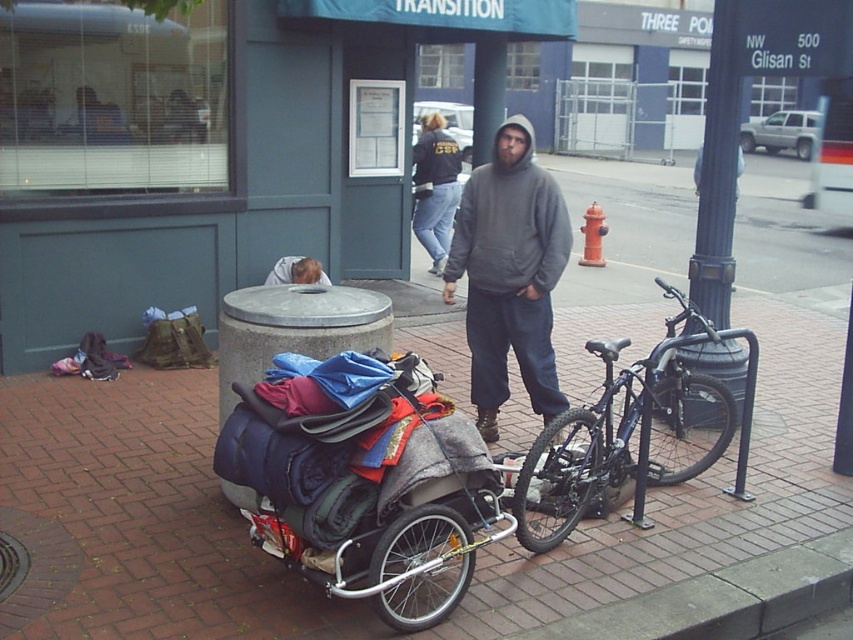
Consider the image. You are a delivery person who needs to reach a package on the sidewalk. You see the shiny blue bike at center and the dark blue jeans at center. Which object is closer to your current position?

The dark blue jeans at center are closer to your current position because the shiny blue bike at center is positioned to the right of them, meaning the jeans are between you and the bike.

Looking at this image, you are a delivery person who needs to transport a package from the shiny blue bike at center to the blue fabric sleeping bag at lower left. Which object should you move the package to, and why?

You should move the package to the blue fabric sleeping bag at lower left because the shiny blue bike at center is larger in size and may not be the destination for the package.

You are a delivery person who needs to pick up a package from the blue fabric sleeping bag at lower left. You are currently standing next to the shiny blue bike at center. Can you reach the sleeping bag without moving the bike?

The shiny blue bike at center is closer to the viewer than the blue fabric sleeping bag at lower left, so you would need to move around or behind the bike to access the sleeping bag.